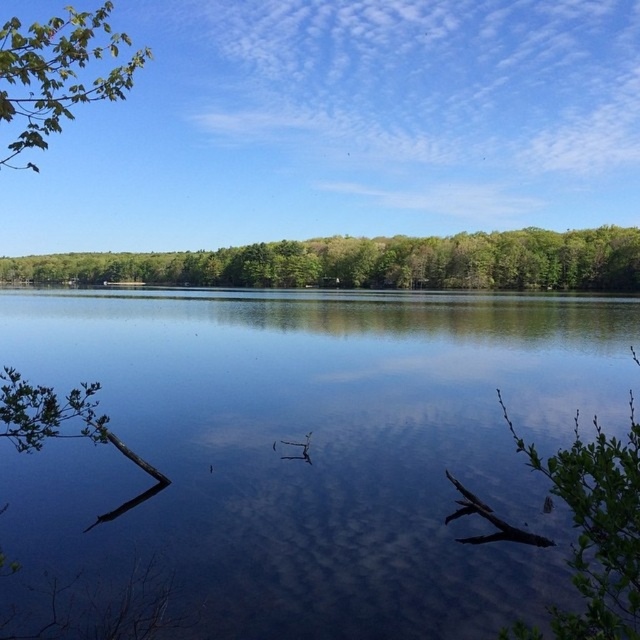
Question: Does transparent water at center appear under green leafy branch at upper left?

Choices:
 (A) no
 (B) yes

Answer: (B)

Question: In this image, where is transparent water at center located relative to green leafy forest at upper center?

Choices:
 (A) above
 (B) below

Answer: (B)

Question: Considering the real-world distances, which object is farthest from the green leafy branch at upper left?

Choices:
 (A) transparent water at center
 (B) green leafy forest at upper center

Answer: (B)

Question: Which object appears farthest from the camera in this image?

Choices:
 (A) transparent water at center
 (B) green leafy branch at upper left

Answer: (A)

Question: Is transparent water at center positioned at the back of green leafy forest at upper center?

Choices:
 (A) yes
 (B) no

Answer: (B)

Question: Which of the following is the farthest from the observer?

Choices:
 (A) green leafy forest at upper center
 (B) transparent water at center
 (C) green leafy branch at upper left

Answer: (A)